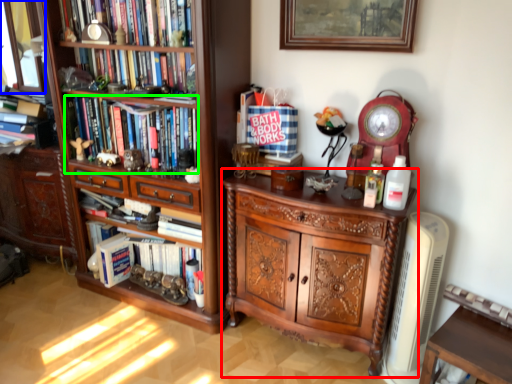
Question: Based on their relative distances, which object is nearer to chest of drawers (highlighted by a red box)? Choose from glass door (highlighted by a blue box) and book (highlighted by a green box).

Choices:
 (A) glass door
 (B) book

Answer: (B)